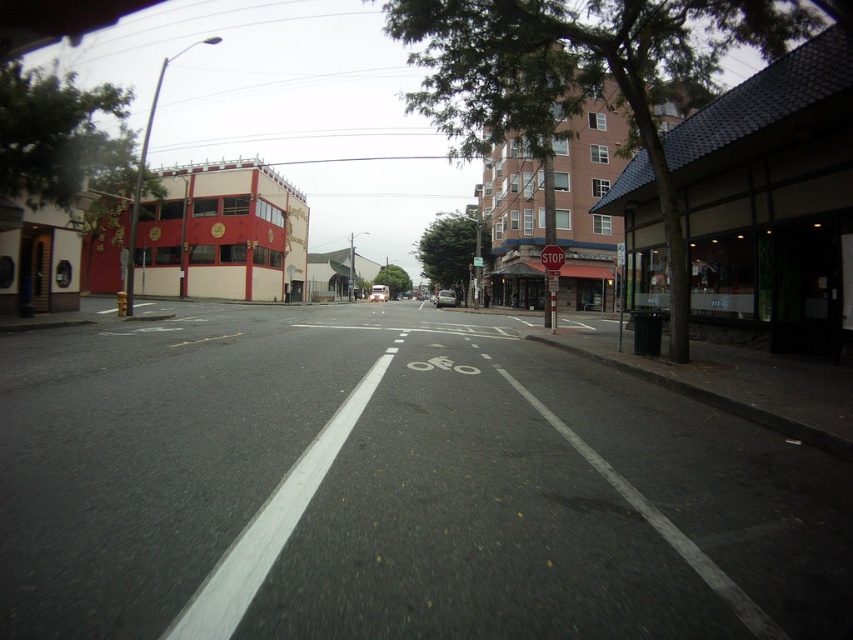
You are driving a car and see two points on the road ahead. The first point is at coordinate point [206,198] and the second is at point [373,289]. Which point is closer to your current position?

Point [206,198] is in front of point [373,289], so the first point is closer to your current position.

You are a delivery driver navigating through the urban street scene. Your route requires you to pass the metallic silver car at center. Based on the scene, can you safely proceed forward without hitting the red matte building at left?

The red matte building at left is above the metallic silver car at center, so it is positioned higher in the image. Since buildings are typically stationary and elevated structures, you can safely proceed forward as the building is not in your direct path and is located above the car, likely on the side of the street. Ensure to follow traffic rules and maintain a safe distance from the car and any obstacles.

You are a delivery driver in a metallic silver car at center who needs to make a quick stop. The red matte building at left is in your path. Is there enough space between you and the building to safely stop your car?

The distance between the red matte building at left and the metallic silver car at center is 66.02 feet, which should provide sufficient space for a safe stop, assuming typical braking conditions.